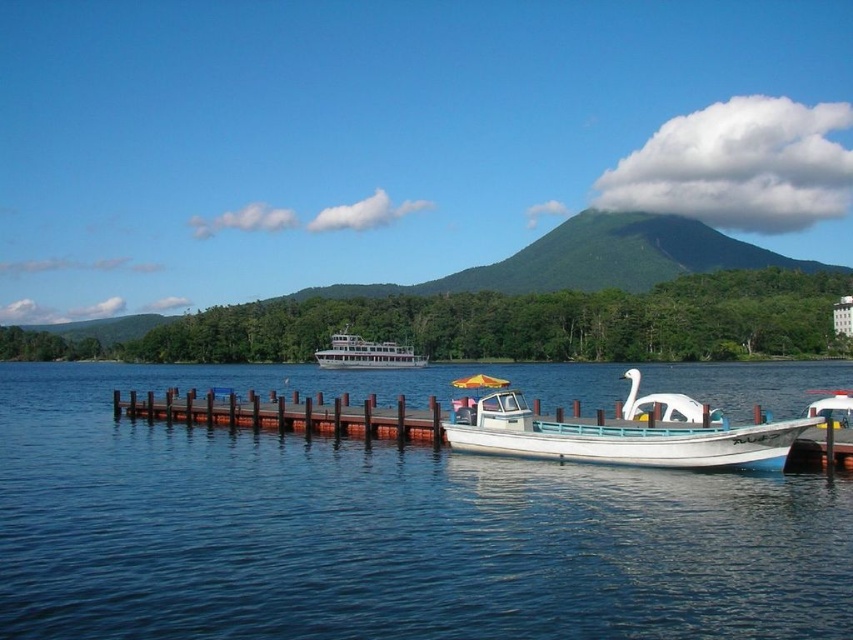
You are planning to dock your boat at the lakeside dock. You see the blue water at dock center and the white glossy ferry at center. Which area is wider for safe docking?

The blue water at dock center is wider than the white glossy ferry at center, so it would be safer to dock there.